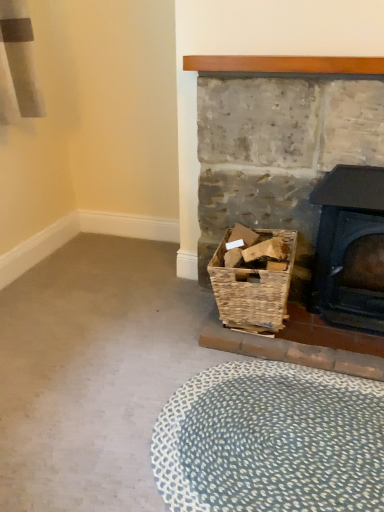
Locate an element on the screen. The width and height of the screenshot is (384, 512). vacant space in front of rustic wicker basket at lower right is located at coordinates (269, 401).